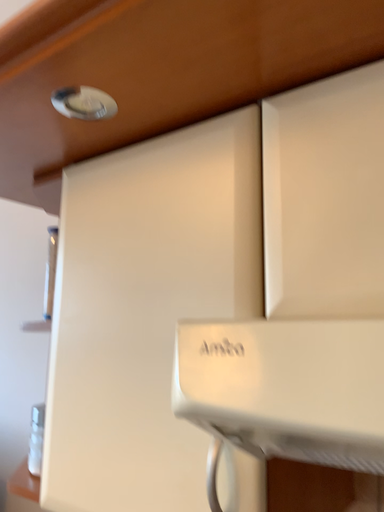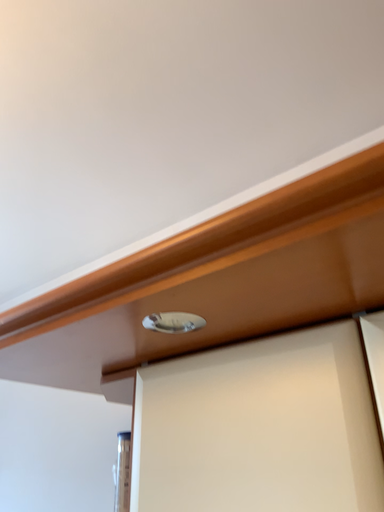
Question: Which way did the camera rotate in the video?

Choices:
 (A) rotated downward
 (B) rotated upward

Answer: (B)